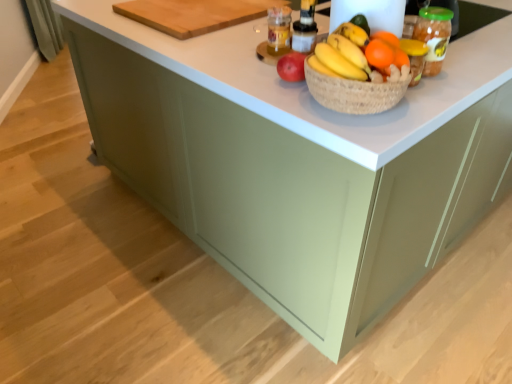
Question: Is orange matte at upper right smaller than orange matte grapefruit at center?

Choices:
 (A) yes
 (B) no

Answer: (A)

Question: From a real-world perspective, is orange matte at upper right over orange matte grapefruit at center?

Choices:
 (A) yes
 (B) no

Answer: (B)

Question: From the image's perspective, is orange matte at upper right above orange matte grapefruit at center?

Choices:
 (A) yes
 (B) no

Answer: (B)

Question: From a real-world perspective, is orange matte at upper right located beneath orange matte grapefruit at center?

Choices:
 (A) no
 (B) yes

Answer: (B)

Question: Is orange matte at upper right outside of orange matte grapefruit at center?

Choices:
 (A) no
 (B) yes

Answer: (A)

Question: Is orange matte at upper right bigger than orange matte grapefruit at center?

Choices:
 (A) no
 (B) yes

Answer: (A)

Question: Is orange matte grapefruit at center aimed at wooden cutting board at upper center?

Choices:
 (A) yes
 (B) no

Answer: (A)

Question: From a real-world perspective, is orange matte grapefruit at center physically above wooden cutting board at upper center?

Choices:
 (A) no
 (B) yes

Answer: (B)

Question: Are orange matte grapefruit at center and wooden cutting board at upper center far apart?

Choices:
 (A) no
 (B) yes

Answer: (A)

Question: Does orange matte grapefruit at center have a lesser width compared to wooden cutting board at upper center?

Choices:
 (A) no
 (B) yes

Answer: (B)

Question: Considering the relative positions of orange matte grapefruit at center and wooden cutting board at upper center in the image provided, is orange matte grapefruit at center to the right of wooden cutting board at upper center from the viewer's perspective?

Choices:
 (A) yes
 (B) no

Answer: (A)

Question: Is orange matte grapefruit at center turned away from wooden cutting board at upper center?

Choices:
 (A) no
 (B) yes

Answer: (A)

Question: Is wooden cutting board at upper center oriented towards orange matte at upper right?

Choices:
 (A) yes
 (B) no

Answer: (B)